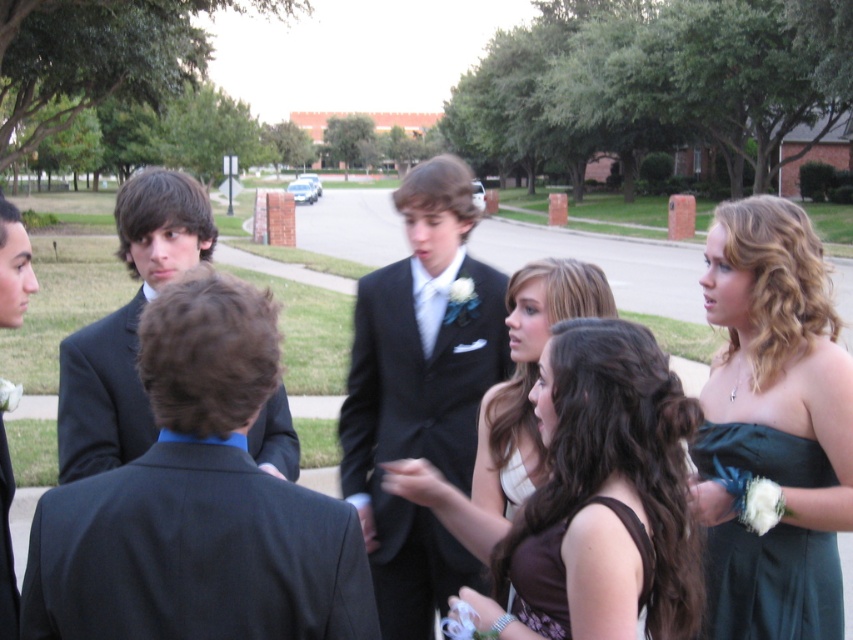
Which is more to the right, matte black suit at center or brown satin dress at lower center?

brown satin dress at lower center

Between matte black suit at center and brown satin dress at lower center, which one appears on the left side from the viewer's perspective?

Positioned to the left is matte black suit at center.

Is point (407, 422) farther from camera compared to point (502, 486)?

Yes, it is.

In order to click on matte black suit at center in this screenshot , I will do `click(421, 392)`.

Between point (744, 584) and point (531, 332), which one is positioned behind?

Positioned behind is point (531, 332).

This screenshot has height=640, width=853. What do you see at coordinates (770, 582) in the screenshot?
I see `dark green satin dress at lower right` at bounding box center [770, 582].

Does point (740, 598) lie in front of point (474, 508)?

Yes.

Locate an element on the screen. dark green satin dress at lower right is located at coordinates (770, 582).

Locate an element on the screen. black wool suit at center is located at coordinates (194, 554).

Where is `black wool suit at center`? This screenshot has width=853, height=640. black wool suit at center is located at coordinates (194, 554).